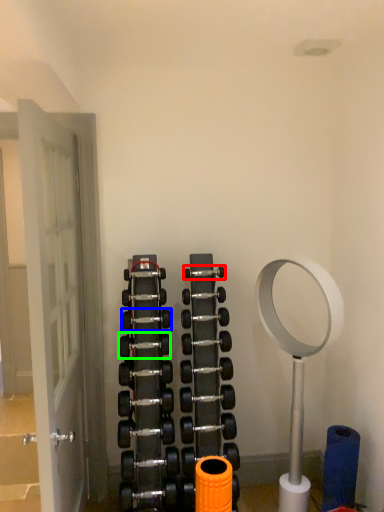
Question: Which object is positioned farthest from dumbbell (highlighted by a red box)? Select from dumbbell (highlighted by a blue box) and dumbbell (highlighted by a green box).

Choices:
 (A) dumbbell
 (B) dumbbell

Answer: (B)